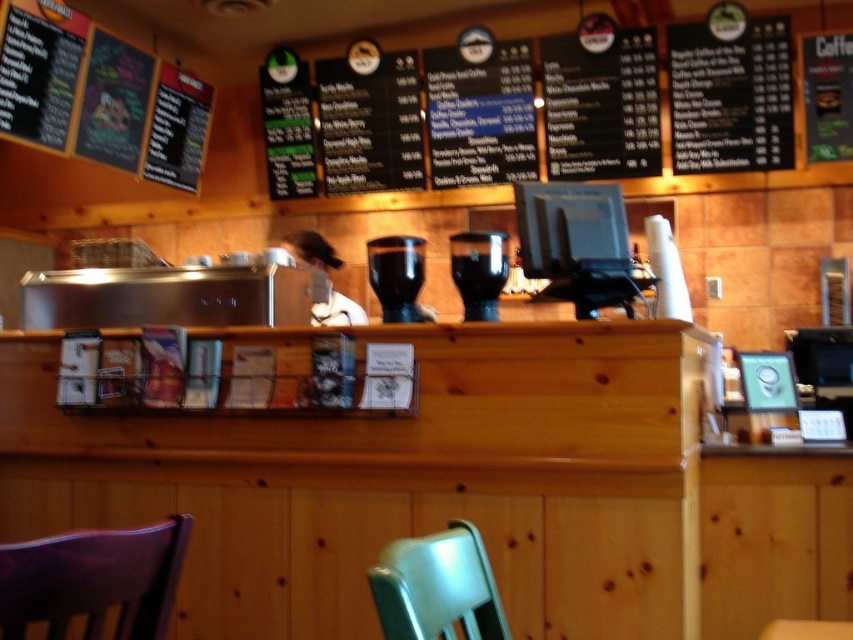
You are a person who is 170 cm tall. You want to sit on the metallic green chair at lower center. Can you comfortably reach the counter to order your coffee?

The metallic green chair at lower center is 77.20 centimeters away from you. Since the average counter height is around 90 cm, and you are 170 cm tall, you can comfortably reach the counter while sitting on the metallic green chair at lower center.

You are a barista who needs to place a new menu board between the black matte coffee machine at center and the white fabric shirt at center. Which object should you place the menu board closer to if you want it to be near the narrower object?

The black matte coffee machine at center has a lesser width compared to the white fabric shirt at center, so you should place the menu board closer to the black matte coffee machine at center.

You are a customer sitting in the purple leather chair at lower left and want to order a drink. The barista is at the counter near the black glass coffee machine at center. Can you easily hand your menu to the barista without leaving your seat?

The purple leather chair at lower left is closer to the viewer than the black glass coffee machine at center, so the distance between them makes it difficult to hand the menu directly. You might need to stand up or ask someone to assist.